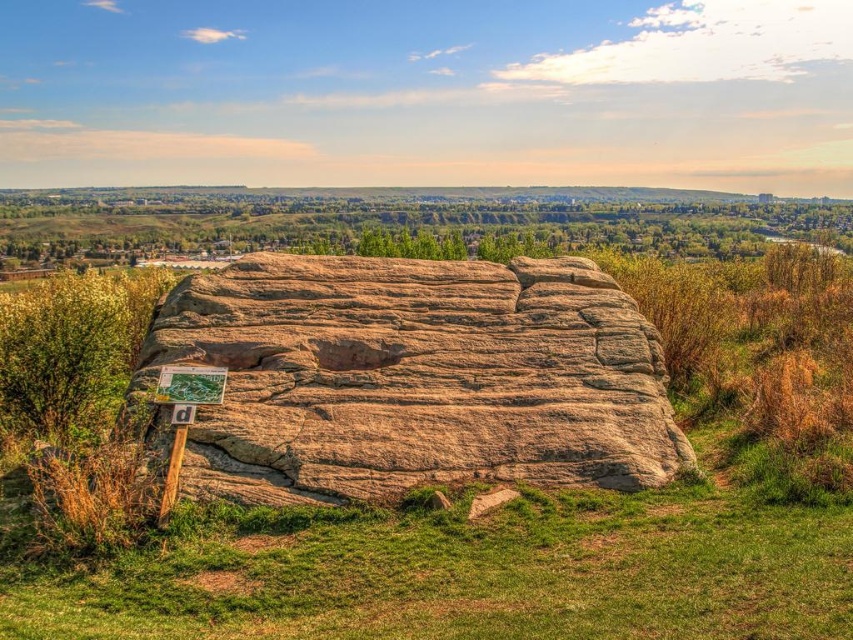
Question: Which of the following is the farthest from the observer?

Choices:
 (A) green grassy at center
 (B) brown textured rock at center

Answer: (B)

Question: Which of the following is the closest to the observer?

Choices:
 (A) (358, 419)
 (B) (169, 552)

Answer: (B)

Question: Does green grassy at center appear under brown textured rock at center?

Choices:
 (A) no
 (B) yes

Answer: (B)

Question: Does green grassy at center appear on the right side of brown textured rock at center?

Choices:
 (A) no
 (B) yes

Answer: (B)

Question: Can you confirm if green grassy at center is positioned below brown textured rock at center?

Choices:
 (A) yes
 (B) no

Answer: (A)